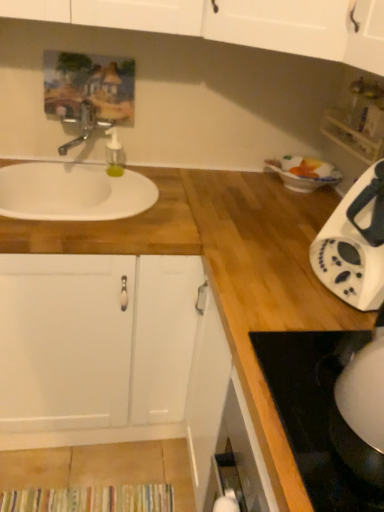
Measure the distance between white glossy bowl at upper right and camera.

A distance of 5.04 feet exists between white glossy bowl at upper right and camera.

Where is `white glossy bowl at upper right`? white glossy bowl at upper right is located at coordinates (304, 173).

What do you see at coordinates (314, 411) in the screenshot? The width and height of the screenshot is (384, 512). I see `white glossy kettle at lower right` at bounding box center [314, 411].

The image size is (384, 512). I want to click on white glossy electric kettle at lower right, so click(364, 390).

The height and width of the screenshot is (512, 384). Describe the element at coordinates (354, 244) in the screenshot. I see `white plastic toaster at right` at that location.

This screenshot has height=512, width=384. In order to click on metallic faucet at upper left in this screenshot , I will do `click(86, 126)`.

Is metallic faucet at upper left at the back of clear plastic soap dispenser at upper center?

Yes, clear plastic soap dispenser at upper center is facing away from metallic faucet at upper left.

Does point (112, 165) come behind point (65, 153)?

That is True.

Consider the image. Is clear plastic soap dispenser at upper center further to the viewer compared to metallic faucet at upper left?

Yes, the depth of clear plastic soap dispenser at upper center is greater than that of metallic faucet at upper left.

From a real-world perspective, which object stands above the other?

metallic faucet at upper left.

Based on the photo, is the position of white glossy kettle at lower right more distant than that of clear plastic soap dispenser at upper center?

No, white glossy kettle at lower right is closer to the camera.

From a real-world perspective, which object stands above the other?

From a 3D spatial view, clear plastic soap dispenser at upper center is above.

In the scene shown: Is white glossy kettle at lower right facing away from clear plastic soap dispenser at upper center?

That's not correct — white glossy kettle at lower right is not looking away from clear plastic soap dispenser at upper center.

From the image's perspective, who appears lower, white glossy kettle at lower right or clear plastic soap dispenser at upper center?

white glossy kettle at lower right is shown below in the image.

Is metallic faucet at upper left at the back of white glossy bowl at upper right?

white glossy bowl at upper right does not have its back to metallic faucet at upper left.

Between white glossy bowl at upper right and metallic faucet at upper left, which one has smaller width?

Thinner between the two is metallic faucet at upper left.

From a real-world perspective, is white glossy bowl at upper right on metallic faucet at upper left?

Incorrect, from a real-world perspective, white glossy bowl at upper right is lower than metallic faucet at upper left.

Considering the relative positions of white glossy bowl at upper right and metallic faucet at upper left in the image provided, is white glossy bowl at upper right to the left or to the right of metallic faucet at upper left?

white glossy bowl at upper right is to the right of metallic faucet at upper left.

Can we say white wood countertop at left lies outside white glossy kettle at lower right?

Absolutely, white wood countertop at left is external to white glossy kettle at lower right.

Does white wood countertop at left come in front of white glossy kettle at lower right?

No, white wood countertop at left is further to the viewer.

Is white wood countertop at left to the right of white glossy kettle at lower right from the viewer's perspective?

No.

Considering their positions, is white plastic shelf at upper right located in front of or behind white glossy kettle at lower right?

Clearly, white plastic shelf at upper right is behind white glossy kettle at lower right.

Measure the distance from white plastic shelf at upper right to white glossy kettle at lower right.

white plastic shelf at upper right and white glossy kettle at lower right are 32.05 inches apart from each other.

Which object is positioned more to the left, white plastic shelf at upper right or white glossy kettle at lower right?

white glossy kettle at lower right.

At what (x,y) coordinates should I click in order to perform the action: click on shelf on the right of the white glossy kettle at lower right. Please return your answer as a coordinate pair (x, y). Looking at the image, I should click on (351, 137).

Locate an element on the screen. countertop that appears on the left of white glossy electric kettle at lower right is located at coordinates (x=114, y=228).

Is white wood countertop at left to the right of white glossy electric kettle at lower right from the viewer's perspective?

No, white wood countertop at left is not to the right of white glossy electric kettle at lower right.

In the scene shown: Between white wood countertop at left and white glossy electric kettle at lower right, which one has larger width?

white wood countertop at left.

Considering the relative sizes of white wood countertop at left and white plastic shelf at upper right in the image provided, is white wood countertop at left bigger than white plastic shelf at upper right?

Yes, white wood countertop at left is bigger than white plastic shelf at upper right.

Is white wood countertop at left to the left or to the right of white plastic shelf at upper right in the image?

white wood countertop at left is to the left of white plastic shelf at upper right.

Considering the positions of point (177, 237) and point (356, 141), is point (177, 237) closer or farther from the camera than point (356, 141)?

Point (177, 237) appears to be closer to the viewer than point (356, 141).

Consider the image. Considering the positions of objects white wood countertop at left and white plastic shelf at upper right in the image provided, who is behind, white wood countertop at left or white plastic shelf at upper right?

white plastic shelf at upper right is more distant.

The image size is (384, 512). Find the location of `soap dispenser behind the metallic faucet at upper left`. soap dispenser behind the metallic faucet at upper left is located at coordinates (114, 154).

The width and height of the screenshot is (384, 512). Find the location of `soap dispenser above the white glossy kettle at lower right (from the image's perspective)`. soap dispenser above the white glossy kettle at lower right (from the image's perspective) is located at coordinates (114, 154).

Estimate the real-world distances between objects in this image. Which object is further from white plastic shelf at upper right, white plastic toaster at right or white matte cabinet at left?

white matte cabinet at left is positioned further to the anchor white plastic shelf at upper right.

Based on their spatial positions, is white plastic shelf at upper right or white matte cabinet at left closer to white glossy kettle at lower right?

Among the two, white matte cabinet at left is located nearer to white glossy kettle at lower right.

Which object lies further to the anchor point white matte cabinet at left, white plastic toaster at right or white glossy bowl at upper right?

The object further to white matte cabinet at left is white glossy bowl at upper right.

Considering their positions, is white wood countertop at left positioned further to white glossy electric kettle at lower right than metallic faucet at upper left?

The object further to white glossy electric kettle at lower right is metallic faucet at upper left.

From the image, which object appears to be farther from metallic faucet at upper left, white glossy bowl at upper right or white glossy kettle at lower right?

Based on the image, white glossy kettle at lower right appears to be further to metallic faucet at upper left.

Estimate the real-world distances between objects in this image. Which object is closer to metallic faucet at upper left, clear plastic soap dispenser at upper center or white matte cabinet at left?

Among the two, clear plastic soap dispenser at upper center is located nearer to metallic faucet at upper left.

From the image, which object appears to be farther from metallic faucet at upper left, clear plastic soap dispenser at upper center or white plastic toaster at right?

white plastic toaster at right is positioned further to the anchor metallic faucet at upper left.

Considering their positions, is metallic faucet at upper left positioned further to white glossy electric kettle at lower right than white matte cabinet at left?

metallic faucet at upper left lies further to white glossy electric kettle at lower right than the other object.

At what (x,y) coordinates should I click in order to perform the action: click on soap dispenser between white matte cabinet at left and white plastic toaster at right. Please return your answer as a coordinate pair (x, y). Image resolution: width=384 pixels, height=512 pixels. Looking at the image, I should click on (114, 154).

Where is `appliance located between metallic faucet at upper left and white plastic toaster at right in the left-right direction`? The width and height of the screenshot is (384, 512). appliance located between metallic faucet at upper left and white plastic toaster at right in the left-right direction is located at coordinates (364, 390).

Image resolution: width=384 pixels, height=512 pixels. Find the location of `home appliance between white glossy kettle at lower right and white glossy bowl at upper right in the front-back direction`. home appliance between white glossy kettle at lower right and white glossy bowl at upper right in the front-back direction is located at coordinates (354, 244).

The height and width of the screenshot is (512, 384). In order to click on home appliance between white glossy kettle at lower right and white plastic shelf at upper right from front to back in this screenshot , I will do `click(354, 244)`.